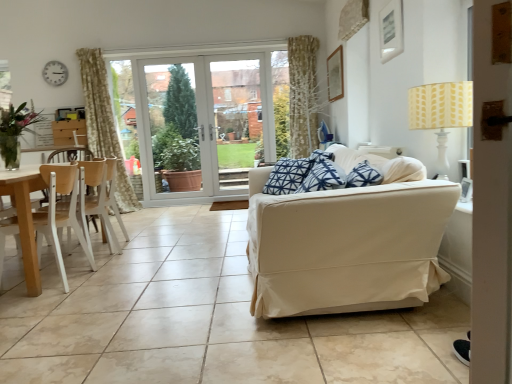
Question: From the image's perspective, would you say wooden chair at left, the 2th chair from the front, is shown under white plastic clock at upper left?

Choices:
 (A) yes
 (B) no

Answer: (A)

Question: Could you tell me if wooden chair at left, acting as the 1th chair starting from the back, is turned towards white plastic clock at upper left?

Choices:
 (A) yes
 (B) no

Answer: (B)

Question: Is wooden chair at left, the 2th chair from the front, thinner than white plastic clock at upper left?

Choices:
 (A) yes
 (B) no

Answer: (B)

Question: Can you confirm if wooden chair at left, acting as the 1th chair starting from the back, is smaller than white plastic clock at upper left?

Choices:
 (A) yes
 (B) no

Answer: (B)

Question: From a real-world perspective, is wooden chair at left, the 2th chair from the front, positioned over white plastic clock at upper left based on gravity?

Choices:
 (A) no
 (B) yes

Answer: (A)

Question: Is wooden chair at left, the 2th chair from the front, looking in the opposite direction of white plastic clock at upper left?

Choices:
 (A) no
 (B) yes

Answer: (A)

Question: Is beige fabric couch at right touching light wood/wooden chair at left, positioned as the 1th chair in front-to-back order?

Choices:
 (A) yes
 (B) no

Answer: (B)

Question: Is light wood/wooden chair at left, positioned as the 1th chair in front-to-back order, completely or partially inside beige fabric couch at right?

Choices:
 (A) no
 (B) yes

Answer: (A)

Question: Does beige fabric couch at right have a greater width compared to light wood/wooden chair at left, positioned as the 1th chair in front-to-back order?

Choices:
 (A) yes
 (B) no

Answer: (A)

Question: From the image's perspective, is beige fabric couch at right below light wood/wooden chair at left, positioned as the 1th chair in front-to-back order?

Choices:
 (A) yes
 (B) no

Answer: (B)

Question: Are beige fabric couch at right and light wood/wooden chair at left, positioned as the 1th chair in front-to-back order, located far from each other?

Choices:
 (A) yes
 (B) no

Answer: (A)

Question: Is beige fabric couch at right aimed at light wood/wooden chair at left, which appears as the second chair when viewed from the back?

Choices:
 (A) no
 (B) yes

Answer: (B)

Question: Considering the relative positions of beige ceramic tile at center and transparent glass door at center in the image provided, is beige ceramic tile at center to the left of transparent glass door at center from the viewer's perspective?

Choices:
 (A) yes
 (B) no

Answer: (A)